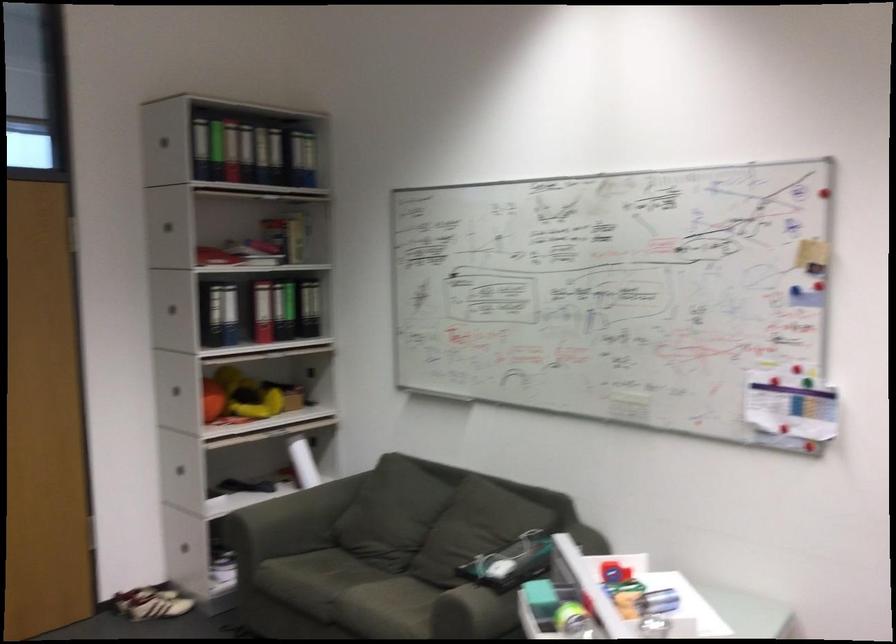
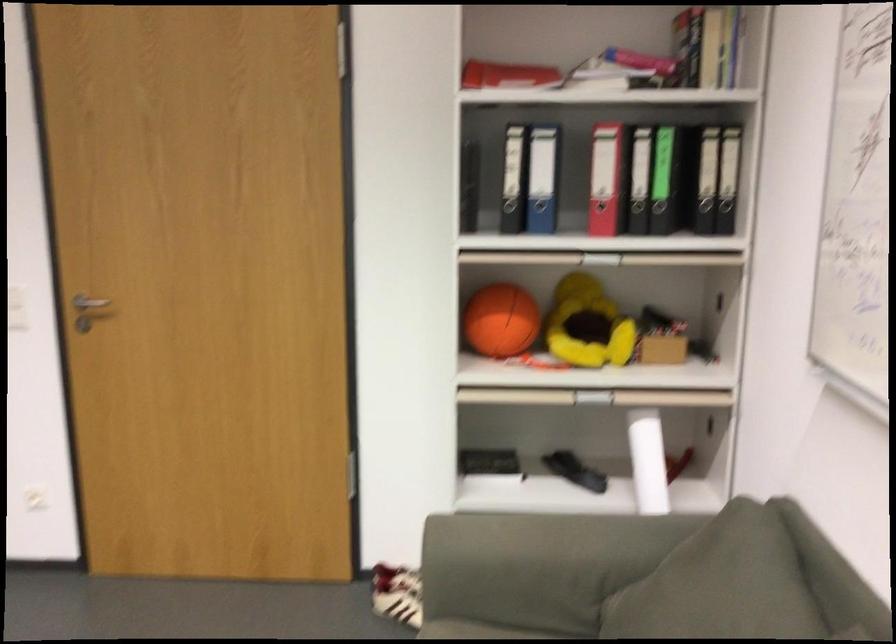
Where in the second image is the point corresponding to [263,319] from the first image?

(606, 178)